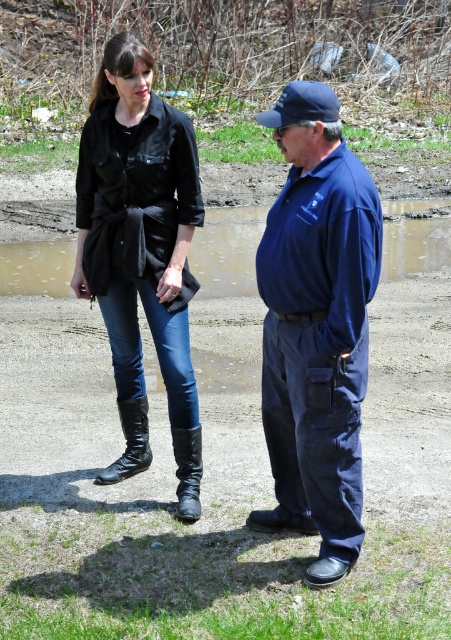
Question: Which point is closer to the camera taking this photo?

Choices:
 (A) (118, 116)
 (B) (164, 339)

Answer: (A)

Question: Which point is farther from the camera taking this photo?

Choices:
 (A) pos(185,518)
 (B) pos(194,468)

Answer: (B)

Question: Does navy blue uniform at center appear over black leather boot at lower left?

Choices:
 (A) no
 (B) yes

Answer: (B)

Question: Does navy blue uniform at center have a lesser width compared to black leather boot at lower center?

Choices:
 (A) yes
 (B) no

Answer: (B)

Question: Which point is closer to the camera taking this photo?

Choices:
 (A) (151, 305)
 (B) (300, 476)
 (C) (322, 140)
 (D) (143, 451)

Answer: (C)

Question: Does black leather boots at lower left appear on the left side of black leather boot at lower center?

Choices:
 (A) yes
 (B) no

Answer: (B)